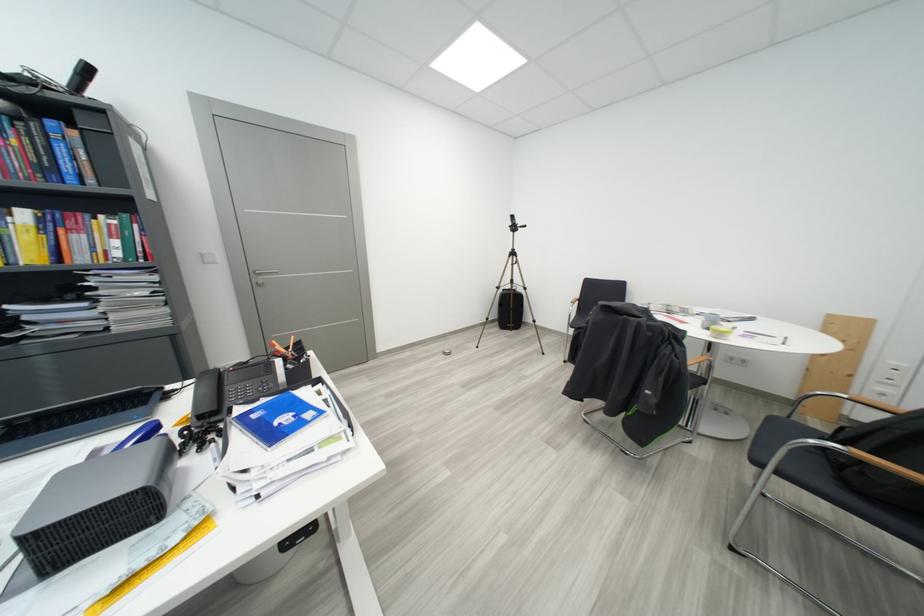
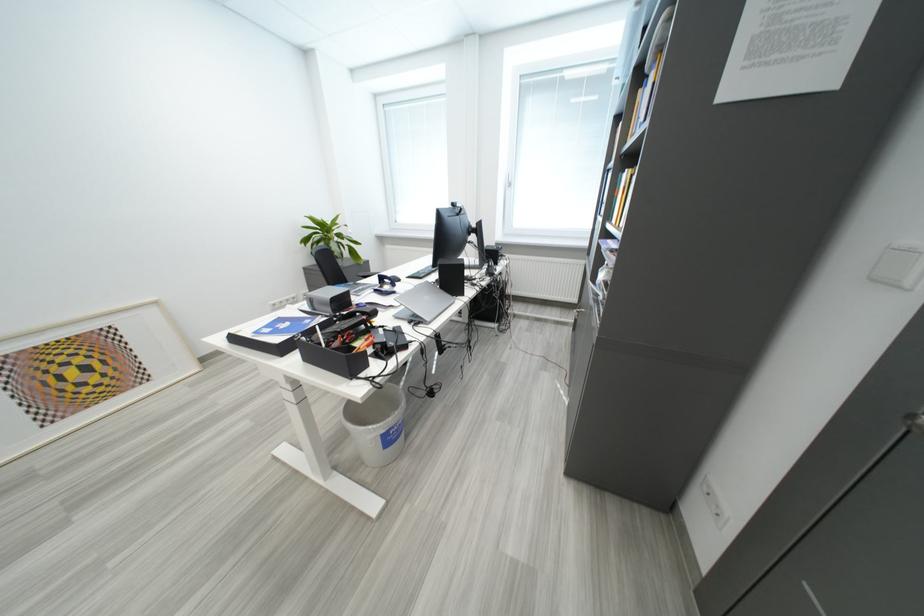
Find the pixel in the second image that matches (x=263, y=419) in the first image.

(317, 323)